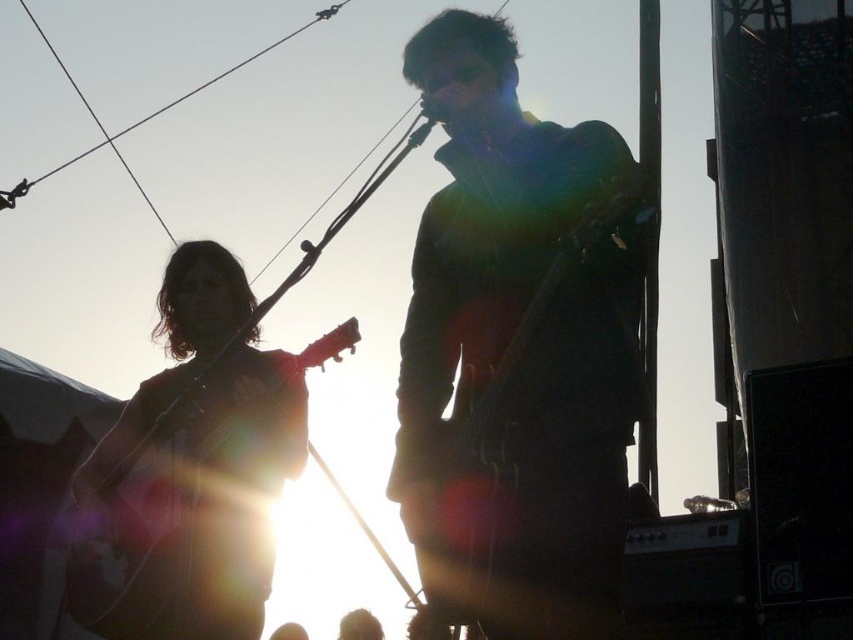
You are a photographer trying to capture the musician on the right. You notice two points in the image labeled as point (x=86, y=596) and point (x=431, y=472). Which point is closer to the camera?

Point (x=431, y=472) is closer to the camera because it is in front of point (x=86, y=596).

You are a photographer at a live music performance. You want to capture the wooden acoustic guitar at left in your shot. What are the coordinates where you should focus your camera?

The wooden acoustic guitar at left is located at coordinates point (202, 508), so you should focus your camera there.

You are a photographer trying to capture a clear shot of both the wooden acoustic guitar at left and the matte black guitar at center. Since the sun is causing glare, which guitar should you adjust your camera angle to focus on first to avoid the glare?

The wooden acoustic guitar at left is positioned on the left side of matte black guitar at center. Since the sun is on the right, adjusting focus to the left side first would help avoid glare affecting both guitars simultaneously.